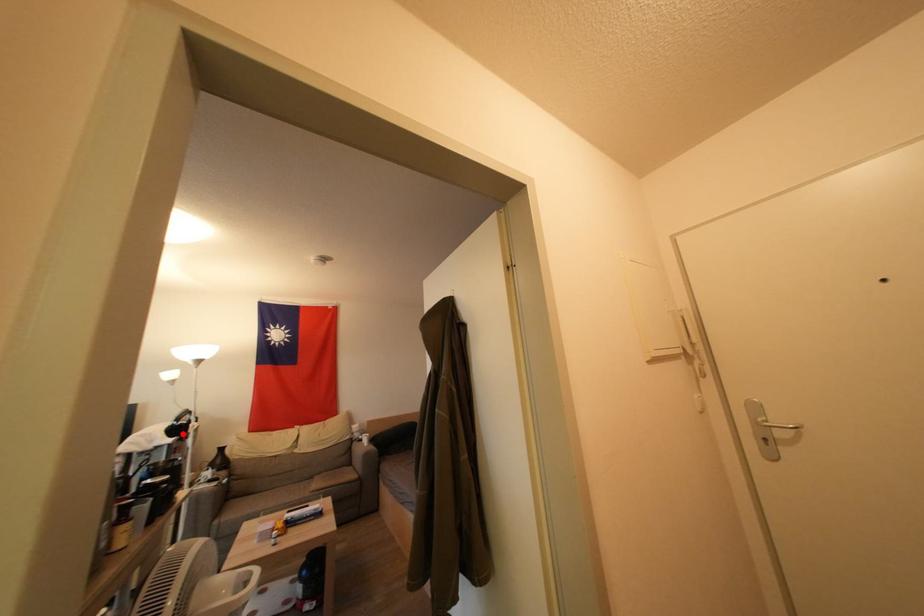
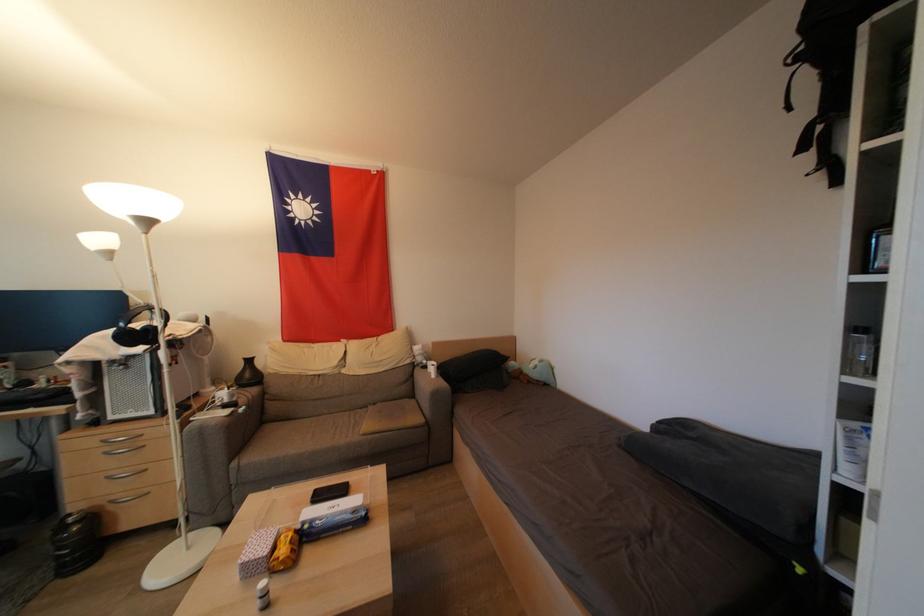
In the second image, find the point that corresponds to the highlighted location in the first image.

(142, 339)